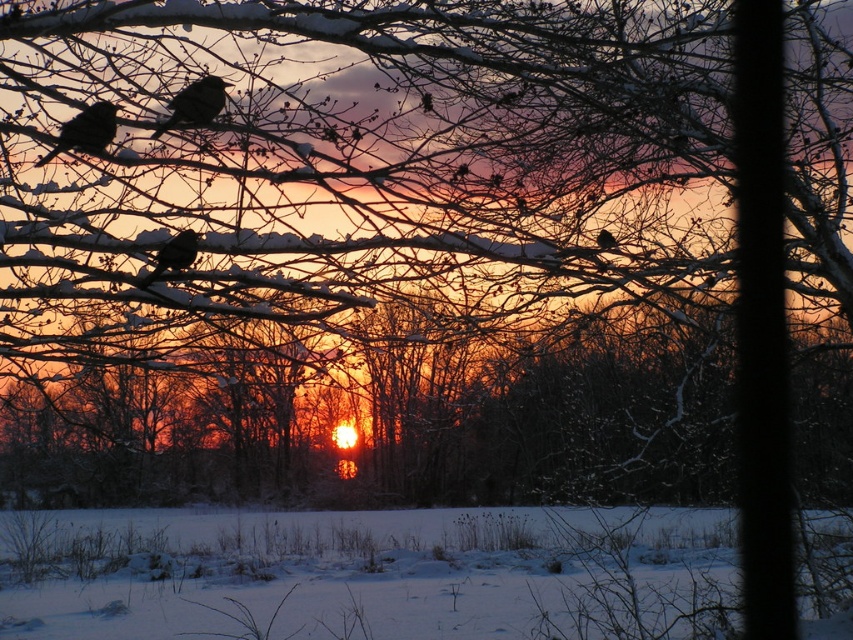
Question: Does black matte bird at center have a larger size compared to matte black bird at center?

Choices:
 (A) yes
 (B) no

Answer: (B)

Question: Which of the following is the closest to the observer?

Choices:
 (A) (112, 129)
 (B) (175, 243)
 (C) (467, 516)

Answer: (A)

Question: Which point appears farthest from the camera in this image?

Choices:
 (A) (154, 257)
 (B) (613, 248)

Answer: (B)

Question: From the image, what is the correct spatial relationship of matte black bird at upper left in relation to black matte bird at center?

Choices:
 (A) below
 (B) above

Answer: (B)

Question: Can you confirm if black matte bird at upper left is thinner than matte black bird at center?

Choices:
 (A) yes
 (B) no

Answer: (B)

Question: Among these objects, which one is farthest from the camera?

Choices:
 (A) black matte bird at upper left
 (B) matte black bird at upper left

Answer: (A)